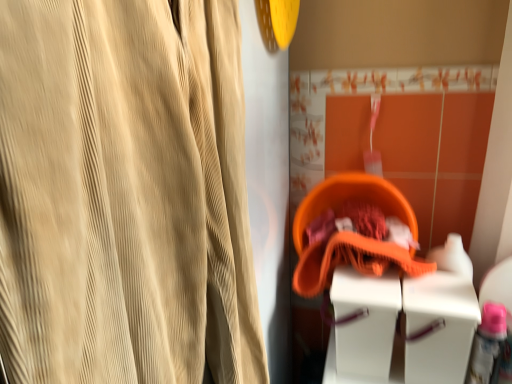
What do you see at coordinates (352, 233) in the screenshot? The width and height of the screenshot is (512, 384). I see `orange fabric basket at center` at bounding box center [352, 233].

Identify the location of orange fabric basket at center. (352, 233).

Identify the location of curtain above the white plastic vanity at lower right (from the image's perspective). The height and width of the screenshot is (384, 512). (125, 194).

From the image's perspective, which object appears higher, beige corduroy curtain at left or white plastic vanity at lower right?

beige corduroy curtain at left is shown above in the image.

Consider the image. Is beige corduroy curtain at left facing away from white plastic vanity at lower right?

beige corduroy curtain at left does not have its back to white plastic vanity at lower right.

Considering the sizes of beige corduroy curtain at left and white plastic vanity at lower right in the image, is beige corduroy curtain at left bigger or smaller than white plastic vanity at lower right?

beige corduroy curtain at left is bigger than white plastic vanity at lower right.

Is beige corduroy curtain at left at the back of white plastic vanity at lower right?

No.

From a real-world perspective, relative to beige corduroy curtain at left, is white plastic vanity at lower right vertically above or below?

white plastic vanity at lower right is below beige corduroy curtain at left.

Can you confirm if white plastic vanity at lower right is thinner than beige corduroy curtain at left?

Indeed, white plastic vanity at lower right has a lesser width compared to beige corduroy curtain at left.

Considering the positions of objects white plastic vanity at lower right and beige corduroy curtain at left in the image provided, who is behind, white plastic vanity at lower right or beige corduroy curtain at left?

white plastic vanity at lower right is more distant.

From the image's perspective, would you say orange fabric basket at center is shown under white plastic vanity at lower right?

No.

How many degrees apart are the facing directions of orange fabric basket at center and white plastic vanity at lower right?

The angular difference between orange fabric basket at center and white plastic vanity at lower right is 1.39 degrees.

Is orange fabric basket at center taller than white plastic vanity at lower right?

Indeed, orange fabric basket at center has a greater height compared to white plastic vanity at lower right.

What's the angular difference between white plastic vanity at lower right and orange fabric basket at center's facing directions?

1.39 degrees.

From a real-world perspective, which is physically above, white plastic vanity at lower right or orange fabric basket at center?

From a 3D spatial view, orange fabric basket at center is above.

Is orange fabric basket at center surrounded by white plastic vanity at lower right?

No, orange fabric basket at center is not surrounded by white plastic vanity at lower right.

Between white plastic vanity at lower right and orange fabric basket at center, which one has larger size?

orange fabric basket at center is bigger.

Is beige corduroy curtain at left completely or partially outside of orange fabric basket at center?

beige corduroy curtain at left lies outside orange fabric basket at center's area.

Which object is closer to the camera, beige corduroy curtain at left or orange fabric basket at center?

beige corduroy curtain at left is in front.

Which is behind, point (161, 135) or point (318, 192)?

Positioned behind is point (318, 192).

Image resolution: width=512 pixels, height=384 pixels. In order to click on curtain above the orange fabric basket at center (from a real-world perspective) in this screenshot , I will do `click(125, 194)`.

Is orange fabric basket at center placed right next to beige corduroy curtain at left?

No, orange fabric basket at center is not beside beige corduroy curtain at left.

From a real-world perspective, is orange fabric basket at center positioned over beige corduroy curtain at left based on gravity?

No.

Would you say orange fabric basket at center is to the left or to the right of beige corduroy curtain at left in the picture?

From the image, it's evident that orange fabric basket at center is to the right of beige corduroy curtain at left.

This screenshot has height=384, width=512. I want to click on vanity lying on the right of beige corduroy curtain at left, so (406, 327).

This screenshot has width=512, height=384. In order to click on curtain above the white plastic vanity at lower right (from a real-world perspective) in this screenshot , I will do `click(125, 194)`.

Which object lies further to the anchor point orange fabric basket at center, white plastic vanity at lower right or beige corduroy curtain at left?

Among the two, beige corduroy curtain at left is located further to orange fabric basket at center.

Based on their spatial positions, is orange fabric basket at center or beige corduroy curtain at left closer to white plastic vanity at lower right?

The object closer to white plastic vanity at lower right is orange fabric basket at center.

Based on their spatial positions, is beige corduroy curtain at left or white plastic vanity at lower right closer to orange fabric basket at center?

white plastic vanity at lower right lies closer to orange fabric basket at center than the other object.

Based on their spatial positions, is white plastic vanity at lower right or orange fabric basket at center further from beige corduroy curtain at left?

Among the two, orange fabric basket at center is located further to beige corduroy curtain at left.

When comparing their distances from white plastic vanity at lower right, does beige corduroy curtain at left or orange fabric basket at center seem closer?

orange fabric basket at center is positioned closer to the anchor white plastic vanity at lower right.

Consider the image. Looking at the image, which one is located further to beige corduroy curtain at left, orange fabric basket at center or white plastic vanity at lower right?

orange fabric basket at center lies further to beige corduroy curtain at left than the other object.

I want to click on vanity between beige corduroy curtain at left and orange fabric basket at center along the z-axis, so click(x=406, y=327).